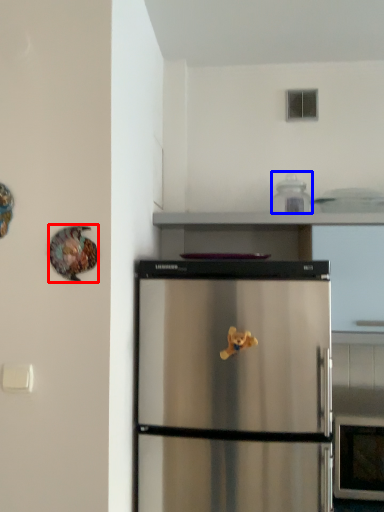
Question: Which object appears farthest to the camera in this image, animal (highlighted by a red box) or appliance (highlighted by a blue box)?

Choices:
 (A) animal
 (B) appliance

Answer: (B)